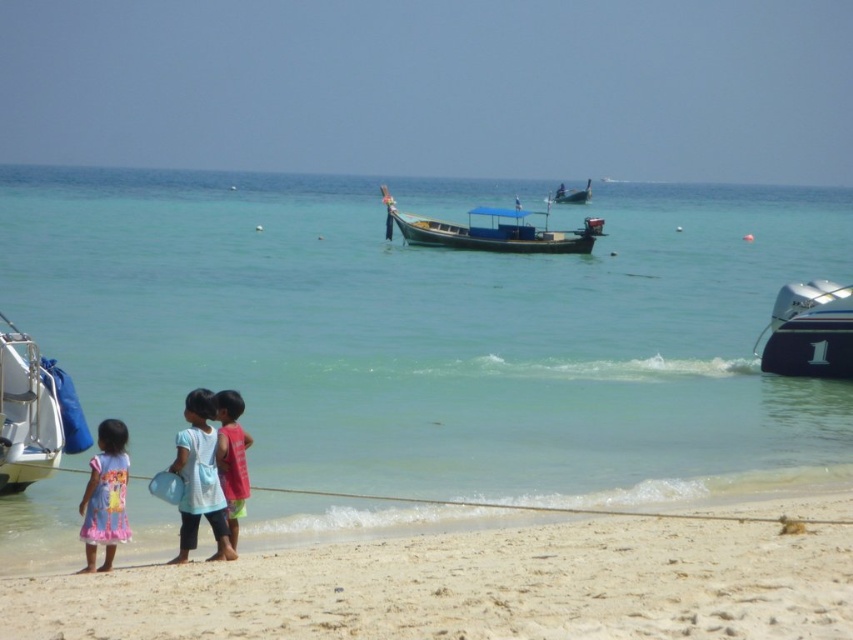
Question: Does printed cotton dress at lower left come in front of red cotton shirt at lower left?

Choices:
 (A) yes
 (B) no

Answer: (A)

Question: Among these objects, which one is nearest to the camera?

Choices:
 (A) white sandy beach at lower left
 (B) white glossy motorboat at right
 (C) light blue fabric dress at lower left

Answer: (A)

Question: Estimate the real-world distances between objects in this image. Which object is closer to the white matte boat at left?

Choices:
 (A) red cotton shirt at lower left
 (B) light blue fabric dress at lower left
 (C) blue wooden boat at center

Answer: (A)

Question: Does white sandy beach at lower left appear on the right side of light blue fabric dress at lower left?

Choices:
 (A) yes
 (B) no

Answer: (A)

Question: Does white sandy beach at lower left appear on the left side of printed cotton dress at lower left?

Choices:
 (A) no
 (B) yes

Answer: (A)

Question: Which of these objects is positioned closest to the white sandy beach at lower left?

Choices:
 (A) white matte boat at left
 (B) wooden longboat at center
 (C) printed cotton dress at lower left

Answer: (C)